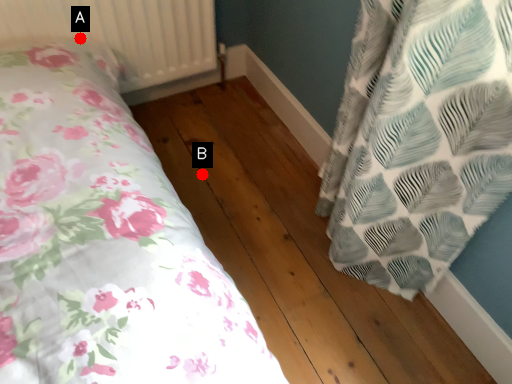
Question: Two points are circled on the image, labeled by A and B beside each circle. Which point is closer to the camera?

Choices:
 (A) A is closer
 (B) B is closer

Answer: (A)